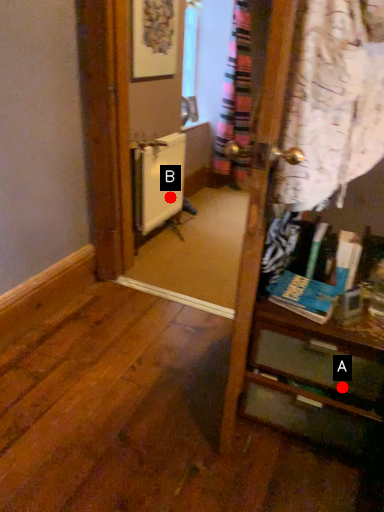
Question: Two points are circled on the image, labeled by A and B beside each circle. Which point appears farthest from the camera in this image?

Choices:
 (A) A is further
 (B) B is further

Answer: (B)